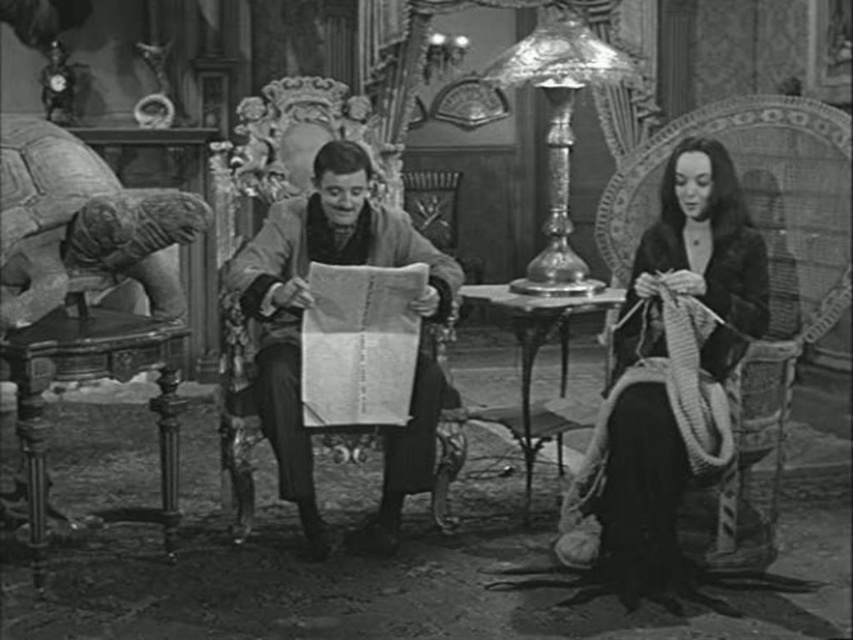
Who is taller, smooth brown coat at center or shiny glass lamp at center?

Standing taller between the two is smooth brown coat at center.

Is smooth brown coat at center thinner than shiny glass lamp at center?

In fact, smooth brown coat at center might be wider than shiny glass lamp at center.

At what (x,y) coordinates should I click in order to perform the action: click on smooth brown coat at center. Please return your answer as a coordinate pair (x, y). This screenshot has width=853, height=640. Looking at the image, I should click on (299, 326).

Identify the location of smooth brown coat at center. (299, 326).

Which of these two, velvet black dress at right or shiny glass lamp at center, stands taller?

With more height is velvet black dress at right.

Is point (602, 531) less distant than point (555, 246)?

Yes, it is in front of point (555, 246).

At what (x,y) coordinates should I click in order to perform the action: click on velvet black dress at right. Please return your answer as a coordinate pair (x, y). The height and width of the screenshot is (640, 853). Looking at the image, I should click on (666, 358).

Is point (630, 536) more distant than point (305, 204)?

No, (630, 536) is in front of (305, 204).

Is velvet black dress at right shorter than smooth brown coat at center?

No.

Where is `velvet black dress at right`? velvet black dress at right is located at coordinates (666, 358).

The image size is (853, 640). What are the coordinates of `velvet black dress at right` in the screenshot? It's located at (666, 358).